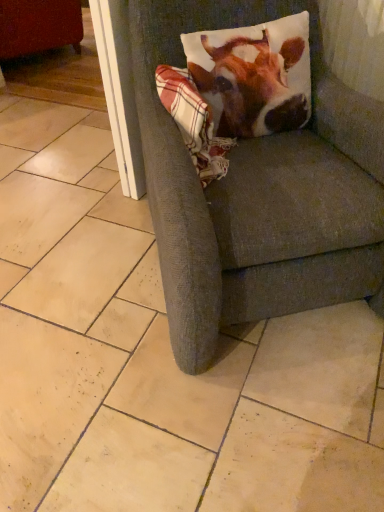
Locate an element on the screen. free space that is to the left of textured gray armchair at center is located at coordinates (71, 247).